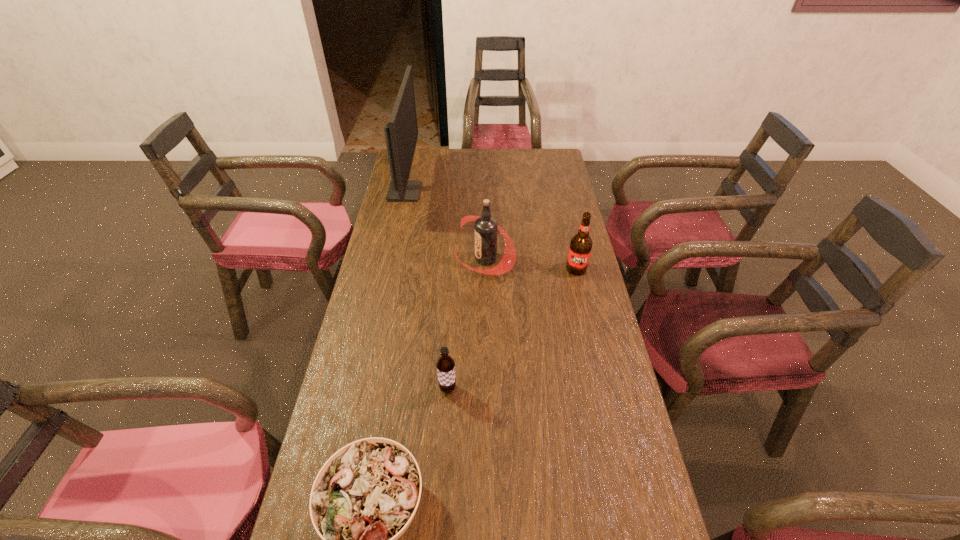
This screenshot has width=960, height=540. I want to click on object that is positioned at the right edge, so click(x=580, y=248).

You are a GUI agent. You are given a task and a screenshot of the screen. Output one action in this format:
    pyautogui.click(x=<x>, y=<y>)
    Task: Click on the object that is at the far left corner
    
    Given the screenshot: What is the action you would take?
    pyautogui.click(x=401, y=133)

In the image, there is a desktop. Find the location of `free space at the left edge`. free space at the left edge is located at coordinates (402, 335).

This screenshot has height=540, width=960. What are the coordinates of `vacant area at the right edge of the desktop` in the screenshot? It's located at (556, 231).

Locate an element on the screen. This screenshot has width=960, height=540. vacant space that is in between the fourth tallest object and the rightmost root beer is located at coordinates click(x=512, y=329).

This screenshot has width=960, height=540. In order to click on vacant space that is in between the farthest object and the shortest root beer in this screenshot , I will do 426,291.

The image size is (960, 540). I want to click on vacant space that is in between the nearest root beer and the tallest object, so click(426, 291).

Choose which object is the second nearest neighbor to the shortest root beer. Please provide its 2D coordinates. Your answer should be formatted as a tuple, i.e. [(x, y)], where the tuple contains the x and y coordinates of a point satisfying the conditions above.

[(486, 228)]

This screenshot has height=540, width=960. Find the location of `object that is the second closest to the rightmost root beer`. object that is the second closest to the rightmost root beer is located at coordinates (445, 364).

Find the location of a particular element. This screenshot has width=960, height=540. root beer that is the closest to the rightmost root beer is located at coordinates (486, 228).